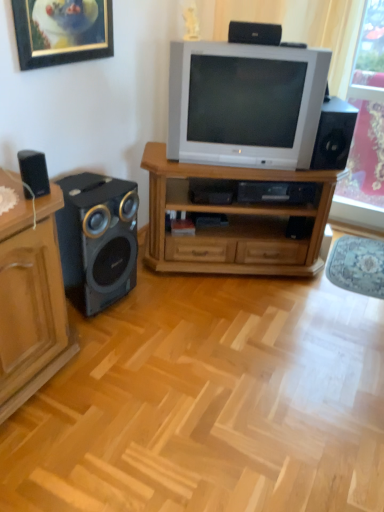
Find the location of a particular element. This screenshot has width=384, height=512. free location to the right of matte wood cabinet at left is located at coordinates (123, 376).